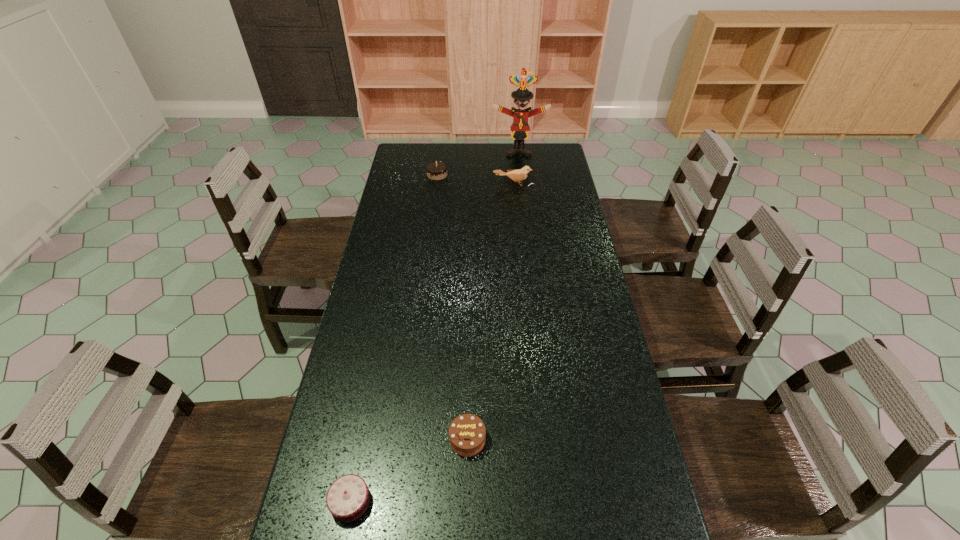
Find the location of a particular element. object that is at the far right corner is located at coordinates pos(520,127).

Image resolution: width=960 pixels, height=540 pixels. Find the location of `vacant space at the far edge`. vacant space at the far edge is located at coordinates (490, 147).

Locate an element on the screen. The image size is (960, 540). vacant space at the left edge of the desktop is located at coordinates (402, 339).

You are a GUI agent. You are given a task and a screenshot of the screen. Output one action in this format:
    pyautogui.click(x=<x>, y=<y>)
    Task: Click on the vacant space at the right edge
    The image size is (960, 540).
    Given the screenshot: What is the action you would take?
    pyautogui.click(x=563, y=207)

You are a GUI agent. You are given a task and a screenshot of the screen. Output one action in this format:
    pyautogui.click(x=<x>, y=<y>)
    Task: Click on the vacant area at the far left corner
    This screenshot has height=540, width=960.
    Given the screenshot: What is the action you would take?
    pyautogui.click(x=405, y=170)

Locate an element on the screen. This screenshot has width=960, height=540. vacant space at the far right corner of the desktop is located at coordinates (531, 148).

At what (x,y) coordinates should I click in order to perform the action: click on empty space between the third farthest object and the leftmost object. Please return your answer as a coordinate pair (x, y). Looking at the image, I should click on (432, 343).

Locate an element on the screen. The image size is (960, 540). vacant area between the second tallest object and the shortest object is located at coordinates (432, 343).

Identify the location of empty space that is in between the nutcracker and the fourth object from right to left. (478, 163).

This screenshot has height=540, width=960. In order to click on vacant space that's between the farthest object and the fourth object from right to left in this screenshot , I will do `click(478, 163)`.